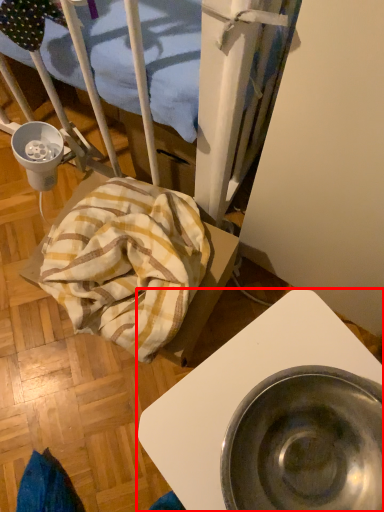
Question: From the image's perspective, considering the relative positions of furniture (annotated by the red box) and blanket in the image provided, where is furniture (annotated by the red box) located with respect to the staircase?

Choices:
 (A) above
 (B) below

Answer: (B)